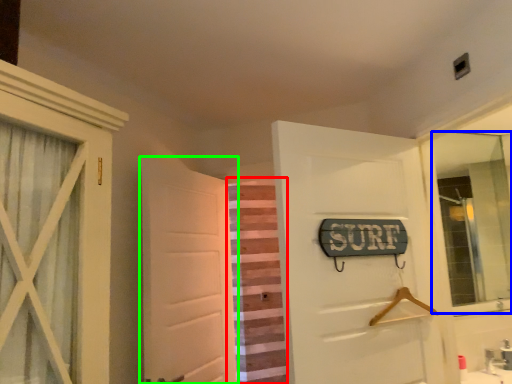
Question: Which is farther away from curtain (highlighted by a red box)? mirror (highlighted by a blue box) or door (highlighted by a green box)?

Choices:
 (A) mirror
 (B) door

Answer: (A)